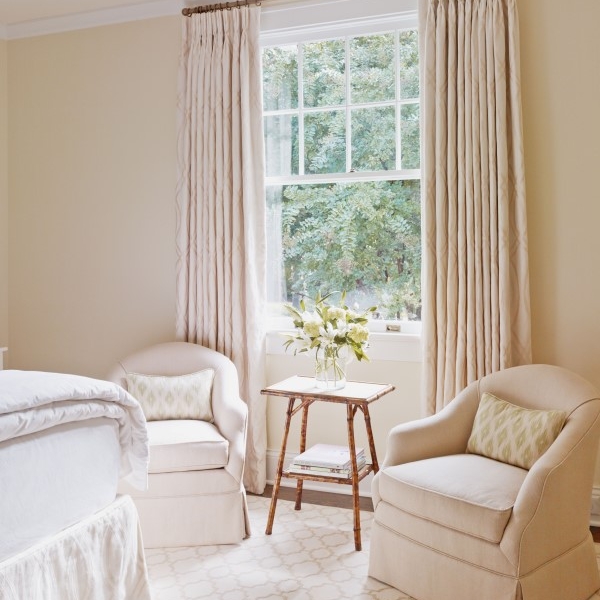
You are a GUI agent. You are given a task and a screenshot of the screen. Output one action in this format:
    pyautogui.click(x=<x>, y=<y>)
    Task: Click on the glass window panels
    Image resolution: width=600 pixels, height=600 pixels.
    Given the screenshot: What is the action you would take?
    pyautogui.click(x=286, y=82), pyautogui.click(x=280, y=145), pyautogui.click(x=321, y=146), pyautogui.click(x=323, y=91), pyautogui.click(x=371, y=93), pyautogui.click(x=373, y=133), pyautogui.click(x=413, y=134), pyautogui.click(x=408, y=87), pyautogui.click(x=353, y=255)